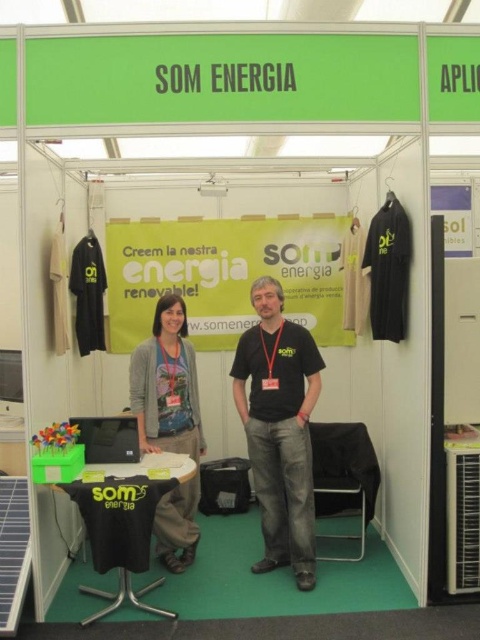
Between point (239, 406) and point (137, 424), which one is positioned behind?

Positioned behind is point (239, 406).

From the picture: Can you confirm if black matte t-shirt at center is taller than matte gray sweater at center?

Yes.

Describe the element at coordinates (279, 428) in the screenshot. I see `black matte t-shirt at center` at that location.

Where is `black matte t-shirt at center`? black matte t-shirt at center is located at coordinates tap(279, 428).

Between green fabric banner at center and matte gray sweater at center, which one appears on the left side from the viewer's perspective?

From the viewer's perspective, matte gray sweater at center appears more on the left side.

You are a GUI agent. You are given a task and a screenshot of the screen. Output one action in this format:
    pyautogui.click(x=<x>, y=<y>)
    Task: Click on the green fabric banner at center
    The height and width of the screenshot is (640, 480).
    Given the screenshot: What is the action you would take?
    pyautogui.click(x=225, y=275)

Between point (338, 225) and point (147, 356), which one is positioned behind?

The point (338, 225) is more distant.

Find the location of `green fabric banner at center`. green fabric banner at center is located at coordinates (225, 275).

Identify the location of black cotton t-shirt at center. 279,428.

Is black cotton t-shirt at center closer to camera compared to matte gray sweater at center?

No, it is behind matte gray sweater at center.

Which is in front, point (301, 456) or point (194, 540)?

Point (301, 456) is more forward.

Where is `black cotton t-shirt at center`? black cotton t-shirt at center is located at coordinates (279, 428).